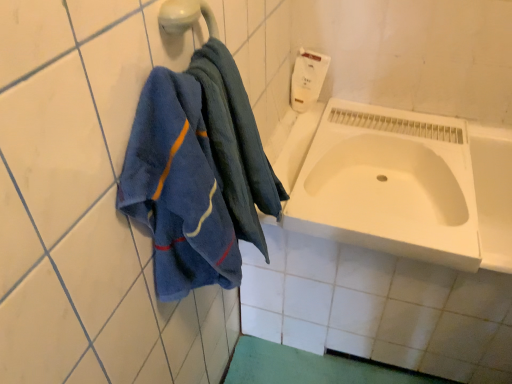
Where is `vacant space in front of white matte soap dispenser at upper right`? This screenshot has width=512, height=384. vacant space in front of white matte soap dispenser at upper right is located at coordinates (317, 129).